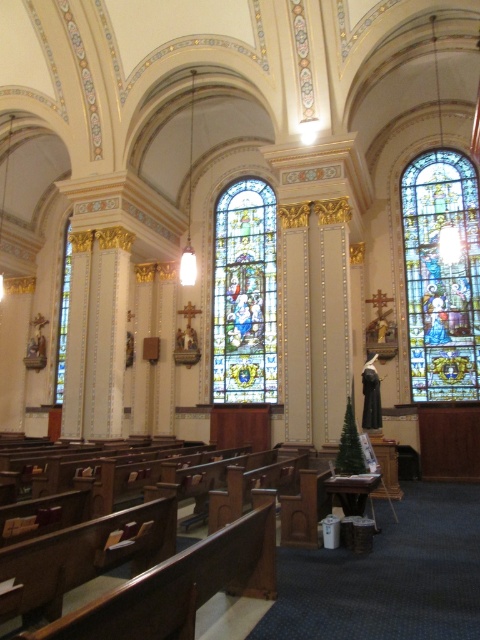
You are standing in the church and want to take a closer look at the stained glass windows. If you face the front of the church, which stained glass window is positioned to the right of the other? The stained glass window at right or the stained glass window at center?

The stained glass window at right is positioned to the right of the stained glass window at center.

You are standing inside the church and notice two stained glass windows, the stained glass window at right and the stained glass window at left. Which one appears closer to you?

The stained glass window at right appears closer to you because it is in front of the stained glass window at left.

You are standing in the church and want to determine which of the two points, point (429, 246) or point (220, 390), is closer to you. Based on the description, which point is nearer?

Point (429, 246) is closer to the viewer than point (220, 390).